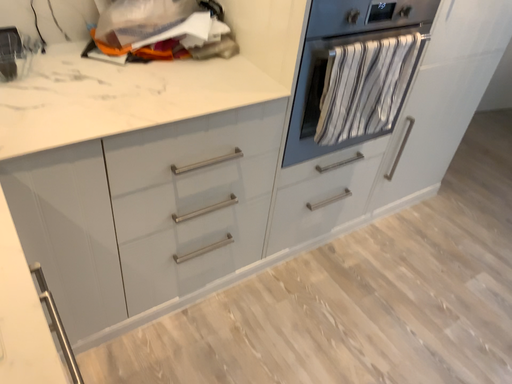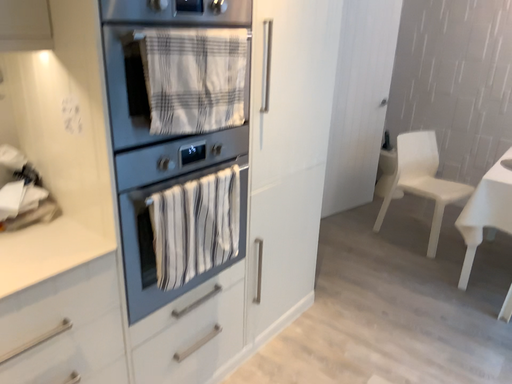
Question: How did the camera likely rotate when shooting the video?

Choices:
 (A) rotated left
 (B) rotated right

Answer: (B)